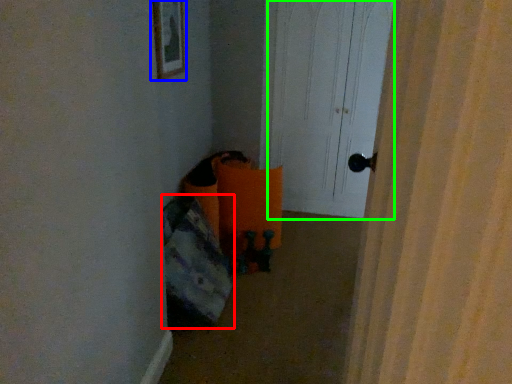
Question: Which object is the closest to the bean bag chair (highlighted by a red box)? Choose among these: picture frame (highlighted by a blue box) or screen door (highlighted by a green box).

Choices:
 (A) picture frame
 (B) screen door

Answer: (A)